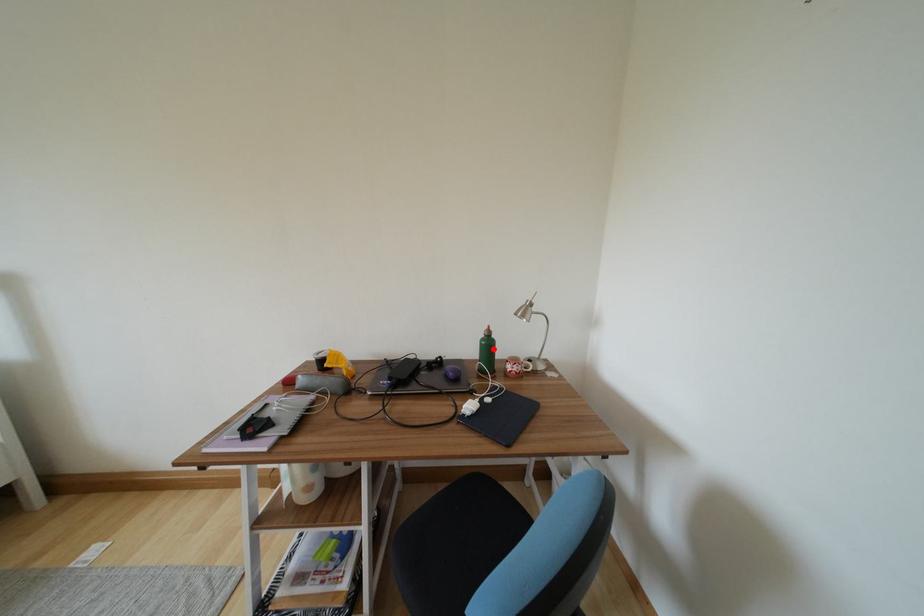
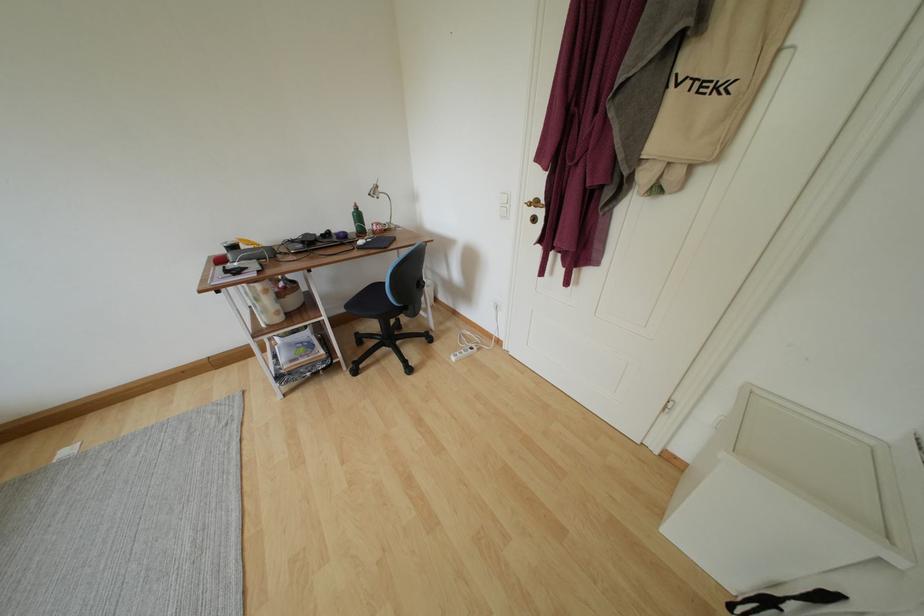
Locate, in the second image, the point that corresponds to the highlighted location in the first image.

(363, 220)